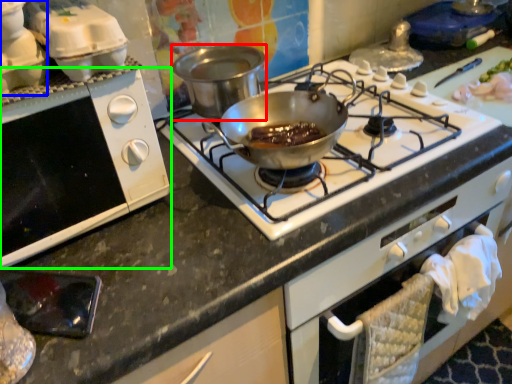
Question: Which is nearer to the pot/pan (highlighted by a red box)? kitchen appliance (highlighted by a blue box) or oven (highlighted by a green box).

Choices:
 (A) kitchen appliance
 (B) oven

Answer: (B)